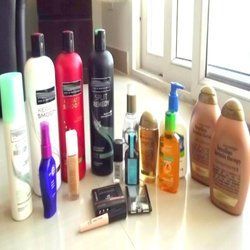
The height and width of the screenshot is (250, 250). In order to click on small blue bottle with a purple top in this screenshot , I will do `click(50, 179)`.